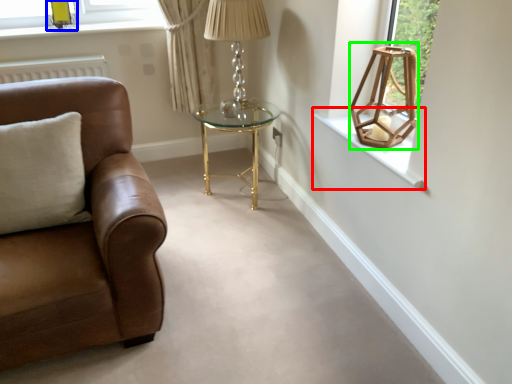
Question: Which object is the closest to the window sill (highlighted by a red box)? Choose among these: lamp (highlighted by a blue box) or lamp (highlighted by a green box).

Choices:
 (A) lamp
 (B) lamp

Answer: (B)